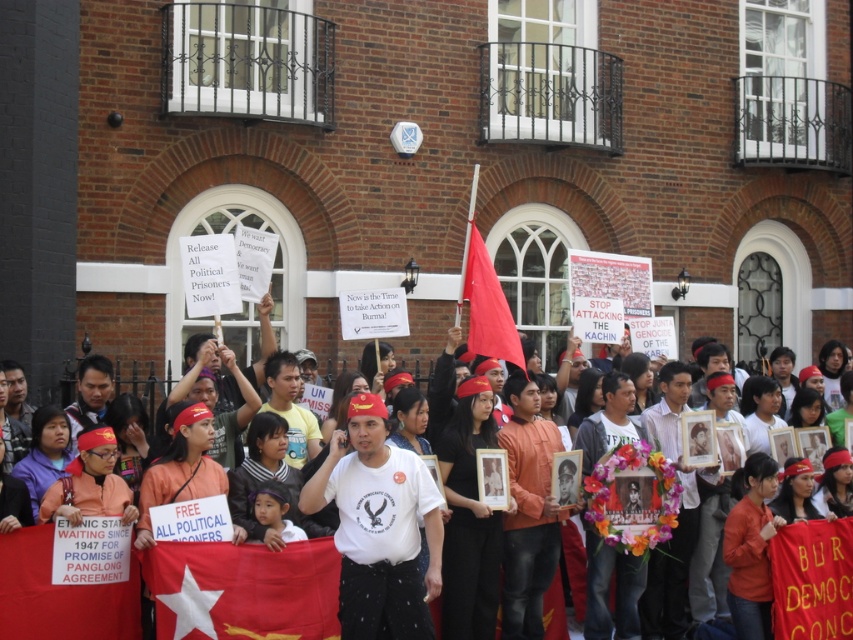
You are a photographer at the protest. You want to capture a photo where both the white cotton shirt at center and the red fabric flag at center are visible. Given their sizes, which object will occupy more space in the photo?

The white cotton shirt at center will occupy more space in the photo because its width surpasses that of the red fabric flag at center.

You are a photographer standing at the edge of the protest crowd. You want to capture both the red fabric flag at center and the matte red flag at center in a single photo. Given that your camera has a maximum focus range of 9 meters, will you be able to capture both flags in focus?

The red fabric flag at center and matte red flag at center are 9.27 meters apart from each other. Since your camera can only focus up to 9 meters, the distance between them exceeds the maximum focus range. Therefore, you will not be able to capture both flags in focus in a single photo.